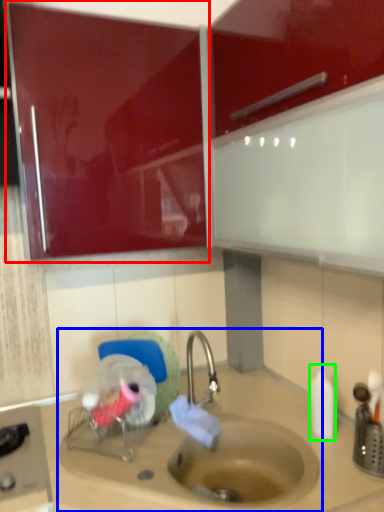
Question: Considering the real-world distances, which object is farthest from cabinetry (highlighted by a red box)? sink (highlighted by a blue box) or bottle (highlighted by a green box)?

Choices:
 (A) sink
 (B) bottle

Answer: (B)